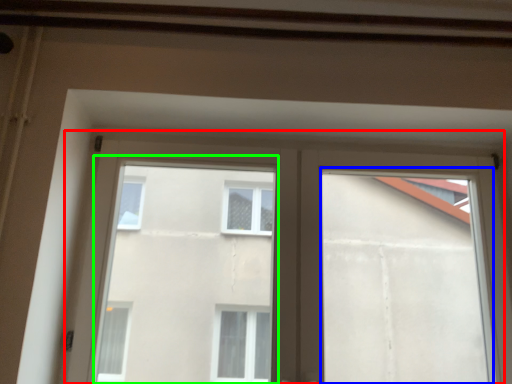
Question: Estimate the real-world distances between objects in this image. Which object is farther from window (highlighted by a red box), window frame (highlighted by a blue box) or bay window (highlighted by a green box)?

Choices:
 (A) window frame
 (B) bay window

Answer: (B)